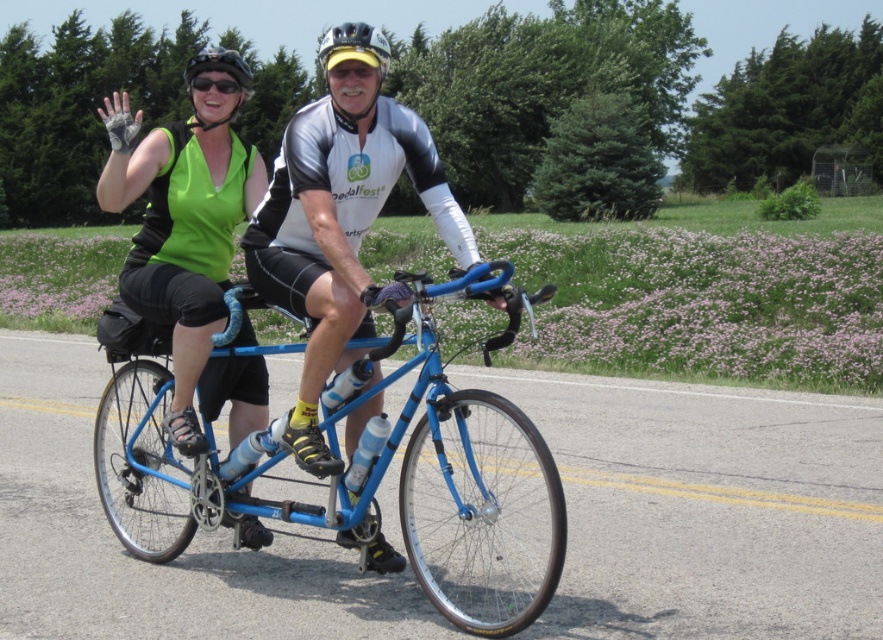
Does point (209, 51) come farther from viewer compared to point (202, 90)?

Yes, point (209, 51) is behind point (202, 90).

Is point (229, 65) closer to camera compared to point (209, 72)?

Yes.

Does point (217, 124) come closer to viewer compared to point (216, 88)?

No, it is not.

The height and width of the screenshot is (640, 883). Find the location of `black matte helmet at upper left`. black matte helmet at upper left is located at coordinates (219, 67).

Consider the image. Who is shorter, matte blue tandem bicycle at center or white matte helmet at center?

matte blue tandem bicycle at center is shorter.

Does matte blue tandem bicycle at center appear over white matte helmet at center?

No.

Describe the element at coordinates (338, 228) in the screenshot. The height and width of the screenshot is (640, 883). I see `matte blue tandem bicycle at center` at that location.

Where is `matte blue tandem bicycle at center`? matte blue tandem bicycle at center is located at coordinates (338, 228).

Is blue metallic bicycle at center smaller than white matte helmet at center?

Indeed, blue metallic bicycle at center has a smaller size compared to white matte helmet at center.

Is point (556, 506) positioned before point (389, 64)?

Yes, it is.

Locate an element on the screen. Image resolution: width=883 pixels, height=640 pixels. blue metallic bicycle at center is located at coordinates (361, 474).